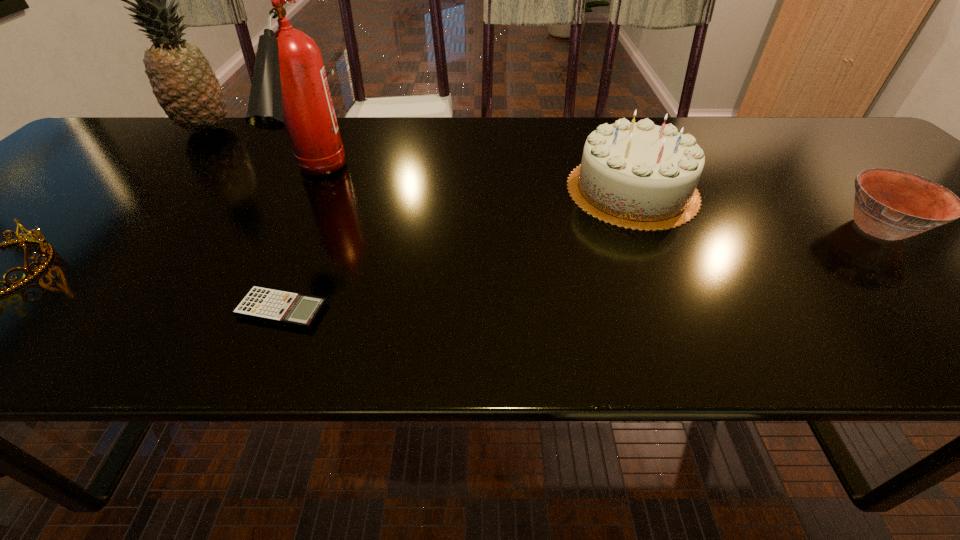
You are a GUI agent. You are given a task and a screenshot of the screen. Output one action in this format:
    pyautogui.click(x=<x>, y=<y>)
    Task: Click on the vacant region located on the left of the bowl
    The width and height of the screenshot is (960, 540).
    Given the screenshot: What is the action you would take?
    678,229

Locate an element on the screen. vacant area situated 0.080m on the left of the shortest object is located at coordinates (192, 310).

I want to click on pineapple located at the far edge, so click(187, 89).

Identify the location of fire extinguisher at the far edge. This screenshot has height=540, width=960. (289, 88).

I want to click on birthday cake situated at the far edge, so click(x=640, y=176).

Identify the location of object present at the near edge. The width and height of the screenshot is (960, 540). 281,307.

Where is `object that is at the right edge`? Image resolution: width=960 pixels, height=540 pixels. object that is at the right edge is located at coordinates (890, 204).

The image size is (960, 540). In the image, there is a desktop. Identify the location of vacant space at the far edge. pyautogui.click(x=709, y=146).

Identify the location of vacant space at the near edge. The height and width of the screenshot is (540, 960). [x=837, y=320].

This screenshot has width=960, height=540. I want to click on vacant space at the left edge of the desktop, so click(x=24, y=201).